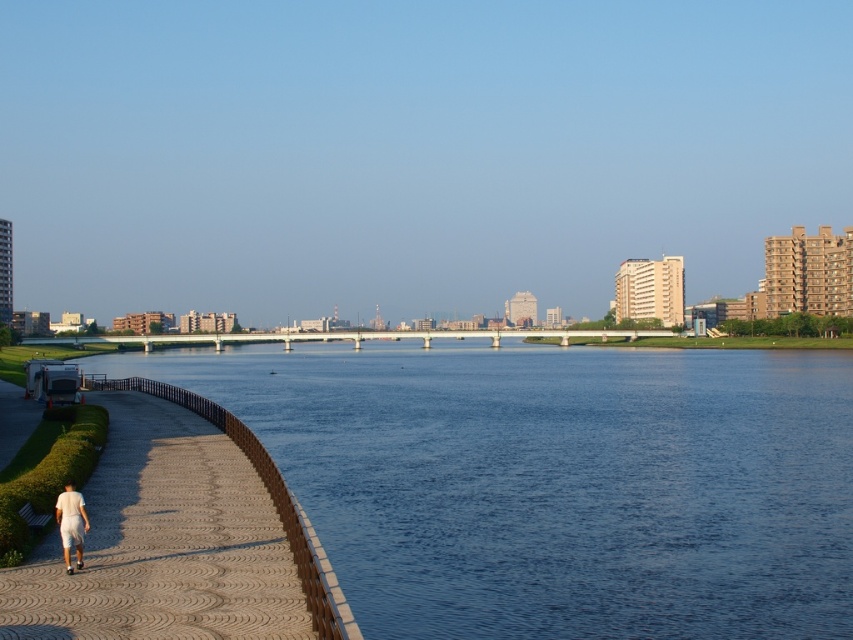
Question: Is blue water at center to the right of white cotton shorts at lower left from the viewer's perspective?

Choices:
 (A) yes
 (B) no

Answer: (A)

Question: Which point appears closest to the camera in this image?

Choices:
 (A) (260, 577)
 (B) (77, 499)
 (C) (685, 458)

Answer: (A)

Question: Does blue water at center have a smaller size compared to white cotton shorts at lower left?

Choices:
 (A) no
 (B) yes

Answer: (A)

Question: Which point is farther from the camera taking this photo?

Choices:
 (A) (151, 525)
 (B) (453, 429)
 (C) (68, 570)

Answer: (B)

Question: Which point is farther from the camera taking this photo?

Choices:
 (A) (547, 362)
 (B) (82, 592)
 (C) (67, 550)

Answer: (A)

Question: Does brown textured pavement at lower left lie behind white cotton shorts at lower left?

Choices:
 (A) yes
 (B) no

Answer: (B)